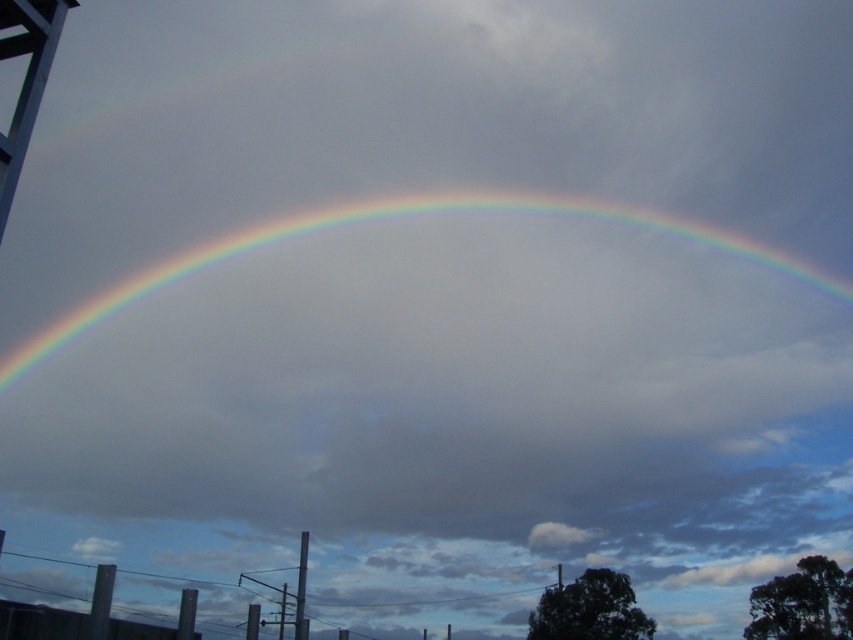
Question: Is rainbow at center bigger than white matte water tower at upper left?

Choices:
 (A) yes
 (B) no

Answer: (A)

Question: Is rainbow at center to the right of white matte water tower at upper left from the viewer's perspective?

Choices:
 (A) yes
 (B) no

Answer: (A)

Question: Is rainbow at center further to the viewer compared to white matte water tower at upper left?

Choices:
 (A) no
 (B) yes

Answer: (B)